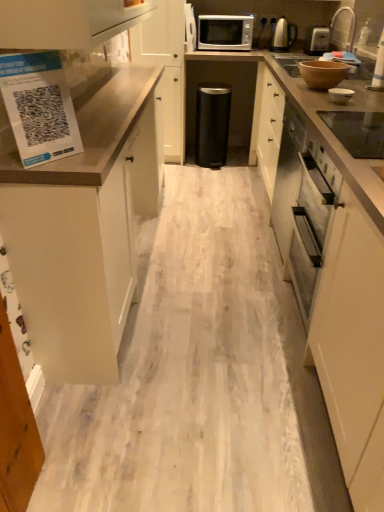
Question: Is brown matte bowl at upper right, arranged as the 3th appliance when viewed from the left, behind white glossy bowl at upper right, acting as the fourth appliance starting from the top?

Choices:
 (A) no
 (B) yes

Answer: (B)

Question: Is brown matte bowl at upper right, the 3th appliance ordered from the bottom, to the right of white glossy bowl at upper right, which appears as the 4th appliance when viewed from the left, from the viewer's perspective?

Choices:
 (A) no
 (B) yes

Answer: (A)

Question: Does brown matte bowl at upper right, marked as the 3th appliance in a top-to-bottom arrangement, turn towards white glossy bowl at upper right, the fourth appliance in the back-to-front sequence?

Choices:
 (A) yes
 (B) no

Answer: (B)

Question: Is white glossy bowl at upper right, acting as the 2th appliance starting from the bottom, surrounded by brown matte bowl at upper right, positioned as the third appliance in back-to-front order?

Choices:
 (A) no
 (B) yes

Answer: (A)

Question: From the image's perspective, is brown matte bowl at upper right, arranged as the 3th appliance when viewed from the left, on top of white glossy bowl at upper right, which appears as the 4th appliance when viewed from the left?

Choices:
 (A) no
 (B) yes

Answer: (B)

Question: Based on their positions, is brown matte bowl at upper right, arranged as the 3th appliance when viewed from the left, located to the left or right of satin silver kettle at upper right?

Choices:
 (A) left
 (B) right

Answer: (A)

Question: From a real-world perspective, is brown matte bowl at upper right, the 3th appliance ordered from the bottom, positioned above or below satin silver kettle at upper right?

Choices:
 (A) below
 (B) above

Answer: (A)

Question: From their relative heights in the image, would you say brown matte bowl at upper right, positioned as the third appliance in back-to-front order, is taller or shorter than satin silver kettle at upper right?

Choices:
 (A) short
 (B) tall

Answer: (A)

Question: Is brown matte bowl at upper right, marked as the 3th appliance in a top-to-bottom arrangement, wider or thinner than satin silver kettle at upper right?

Choices:
 (A) thin
 (B) wide

Answer: (B)

Question: In terms of width, does black glass cooktop at upper right, which is the 1th appliance from front to back, look wider or thinner when compared to black matte trash can at center, which is counted as the 4th appliance, starting from the bottom?

Choices:
 (A) thin
 (B) wide

Answer: (A)

Question: From the image's perspective, is black glass cooktop at upper right, which ranks as the 1th appliance in bottom-to-top order, above or below black matte trash can at center, which is counted as the 4th appliance, starting from the bottom?

Choices:
 (A) above
 (B) below

Answer: (B)

Question: Do you think black glass cooktop at upper right, which ranks as the 1th appliance in bottom-to-top order, is within black matte trash can at center, which is counted as the 4th appliance, starting from the bottom, or outside of it?

Choices:
 (A) inside
 (B) outside

Answer: (B)

Question: In terms of size, does black glass cooktop at upper right, arranged as the fifth appliance when viewed from the top, appear bigger or smaller than black matte trash can at center, which is counted as the 4th appliance, starting from the bottom?

Choices:
 (A) small
 (B) big

Answer: (A)

Question: From a real-world perspective, relative to white glossy bowl at upper right, which appears as the 4th appliance when viewed from the left, is white matte cabinet at center, arranged as the first cabinetry when viewed from the back, vertically above or below?

Choices:
 (A) above
 (B) below

Answer: (B)

Question: In terms of height, does white matte cabinet at center, which ranks as the 2th cabinetry in front-to-back order, look taller or shorter compared to white glossy bowl at upper right, acting as the 2th appliance starting from the bottom?

Choices:
 (A) short
 (B) tall

Answer: (B)